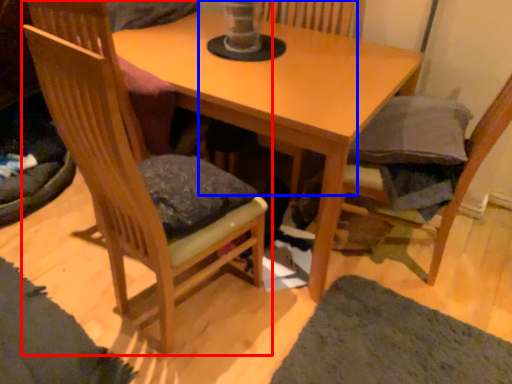
Question: Which point is further to the camera, chair (highlighted by a red box) or swivel chair (highlighted by a blue box)?

Choices:
 (A) chair
 (B) swivel chair

Answer: (B)